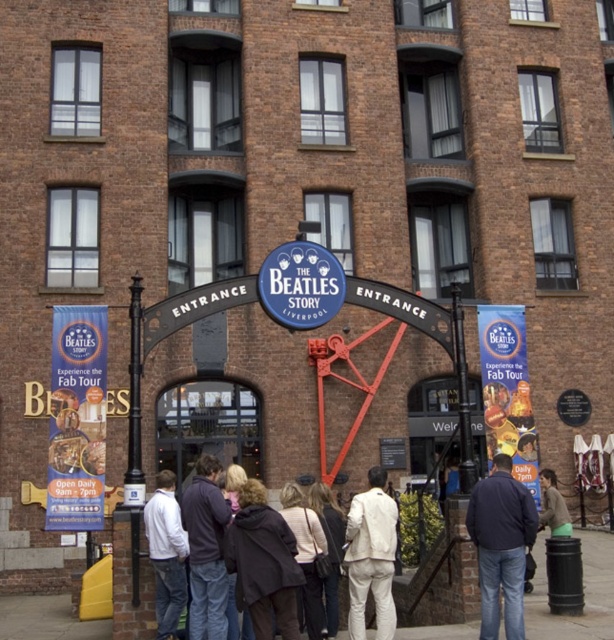
Which is more to the left, dark blue jacket at center or dark brown leather jacket at center?

Positioned to the left is dark brown leather jacket at center.

Locate an element on the screen. Image resolution: width=614 pixels, height=640 pixels. dark blue jacket at center is located at coordinates (502, 545).

Is dark blue jeans at center shorter than white matte jacket at lower left?

No, dark blue jeans at center is not shorter than white matte jacket at lower left.

Measure the distance from dark blue jeans at center to white matte jacket at lower left.

dark blue jeans at center and white matte jacket at lower left are 33.62 inches apart from each other.

This screenshot has height=640, width=614. What are the coordinates of `dark blue jeans at center` in the screenshot? It's located at (206, 548).

Does dark blue jacket at center appear on the right side of dark blue jeans at center?

Correct, you'll find dark blue jacket at center to the right of dark blue jeans at center.

Does point (492, 556) come behind point (188, 531)?

No, it is not.

Describe the element at coordinates (502, 545) in the screenshot. I see `dark blue jacket at center` at that location.

The height and width of the screenshot is (640, 614). In order to click on dark blue jacket at center in this screenshot , I will do `click(502, 545)`.